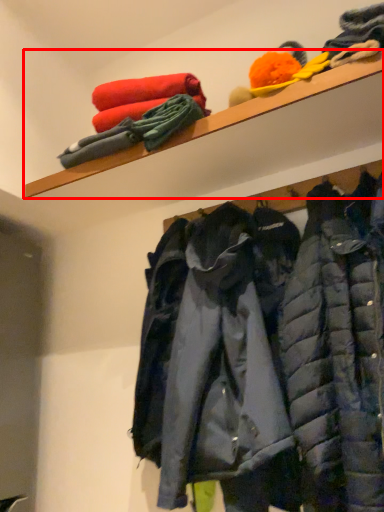
Question: From the image's perspective, where is shelf (annotated by the red box) located relative to jacket?

Choices:
 (A) above
 (B) below

Answer: (A)